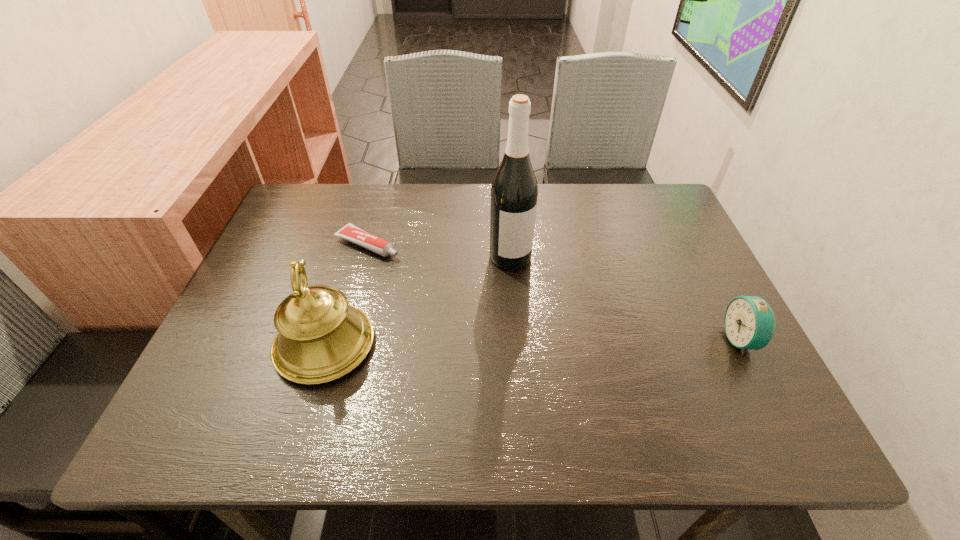
This screenshot has height=540, width=960. I want to click on object situated at the right edge, so (x=749, y=322).

The image size is (960, 540). Identify the location of object situated at the near left corner. (320, 338).

In order to click on object present at the near right corner in this screenshot , I will do `click(749, 322)`.

Identify the location of vacant space at the far edge of the desktop. This screenshot has height=540, width=960. (599, 204).

In the image, there is a desktop. Identify the location of vacant space at the near edge. (470, 372).

In the image, there is a desktop. Where is `vacant region at the left edge`? vacant region at the left edge is located at coordinates (223, 336).

Image resolution: width=960 pixels, height=540 pixels. What are the coordinates of `vacant space at the right edge of the desktop` in the screenshot? It's located at (693, 341).

This screenshot has width=960, height=540. I want to click on free spot at the far left corner of the desktop, so click(x=306, y=195).

Where is `vacant space at the far right corner of the desktop`? vacant space at the far right corner of the desktop is located at coordinates (641, 220).

In the image, there is a desktop. In order to click on vacant area at the near right corner in this screenshot , I will do `click(706, 361)`.